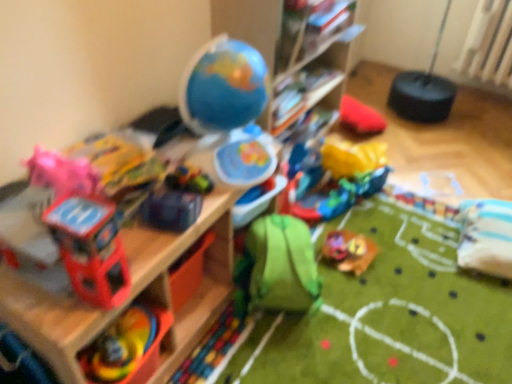
Question: Is shiny blue car at center, arranged as the third toy when viewed from the front, not within green fabric backpack at center, placed as the 2th toy when sorted from back to front?

Choices:
 (A) yes
 (B) no

Answer: (A)

Question: Is shiny blue car at center, arranged as the third toy when viewed from the front, to the right of green fabric backpack at center, acting as the fourth toy starting from the left, from the viewer's perspective?

Choices:
 (A) yes
 (B) no

Answer: (B)

Question: Is green fabric backpack at center, which appears as the 2th toy when viewed from the right, a part of shiny blue car at center, placed as the third toy when sorted from left to right?

Choices:
 (A) no
 (B) yes

Answer: (A)

Question: Is shiny blue car at center, arranged as the third toy when viewed from the front, directly adjacent to green fabric backpack at center, placed as the 2th toy when sorted from back to front?

Choices:
 (A) no
 (B) yes

Answer: (A)

Question: Can you confirm if shiny blue car at center, which is counted as the 3th toy, starting from the back, is smaller than green fabric backpack at center, acting as the fourth toy starting from the left?

Choices:
 (A) yes
 (B) no

Answer: (A)

Question: Is shiny blue car at center, which is counted as the 3th toy, starting from the back, turned away from green fabric backpack at center, the fourth toy when ordered from front to back?

Choices:
 (A) no
 (B) yes

Answer: (A)

Question: From a real-world perspective, is wooden shelf at upper left, which is counted as the first shelf, starting from the left, physically below multicolored plastic toy at lower left, acting as the 1th toy starting from the left?

Choices:
 (A) yes
 (B) no

Answer: (A)

Question: Is multicolored plastic toy at lower left, positioned as the second toy in front-to-back order, inside wooden shelf at upper left, which is counted as the 1th shelf, starting from the bottom?

Choices:
 (A) yes
 (B) no

Answer: (A)

Question: Is wooden shelf at upper left, placed as the 2th shelf when sorted from right to left, behind multicolored plastic toy at lower left, acting as the 5th toy starting from the right?

Choices:
 (A) no
 (B) yes

Answer: (A)

Question: Could you tell me if wooden shelf at upper left, which ranks as the 2th shelf in top-to-bottom order, is turned towards multicolored plastic toy at lower left, acting as the 5th toy starting from the right?

Choices:
 (A) no
 (B) yes

Answer: (B)

Question: Is wooden shelf at upper left, which is counted as the 1th shelf, starting from the bottom, thinner than multicolored plastic toy at lower left, the fourth toy from the back?

Choices:
 (A) yes
 (B) no

Answer: (B)

Question: Would you say wooden shelf at upper left, which is counted as the 1th shelf, starting from the bottom, is a long distance from multicolored plastic toy at lower left, acting as the 1th toy starting from the left?

Choices:
 (A) yes
 (B) no

Answer: (B)

Question: Is green fabric backpack at center, which appears as the 2th toy when viewed from the right, in front of matte plastic toy helicopter at left, which ranks as the fifth toy in back-to-front order?

Choices:
 (A) no
 (B) yes

Answer: (A)